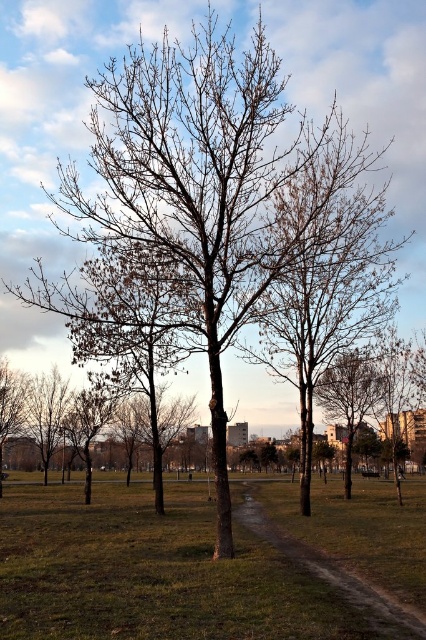
Question: Can you confirm if grassy dirt path at center is smaller than bare branches at right?

Choices:
 (A) yes
 (B) no

Answer: (B)

Question: Which point is closer to the camera taking this photo?

Choices:
 (A) (394, 632)
 (B) (345, 387)
 (C) (127, 506)

Answer: (A)

Question: Which is nearer to the bare branches at right?

Choices:
 (A) green grass at center
 (B) grassy dirt path at center

Answer: (B)

Question: Estimate the real-world distances between objects in this image. Which object is closer to the grassy dirt path at center?

Choices:
 (A) bare branches at right
 (B) green grass at center

Answer: (B)

Question: Is green grass at center positioned behind grassy dirt path at center?

Choices:
 (A) yes
 (B) no

Answer: (B)

Question: Does green grass at center appear on the left side of bare branches at right?

Choices:
 (A) no
 (B) yes

Answer: (B)